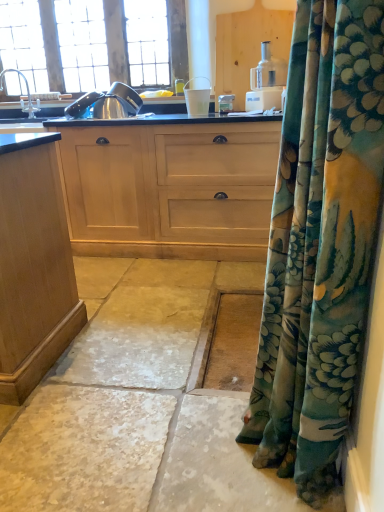
Question: Considering the relative positions of light wood cabinet at center and satin nickel faucet at upper left in the image provided, is light wood cabinet at center in front of satin nickel faucet at upper left?

Choices:
 (A) yes
 (B) no

Answer: (A)

Question: Does light wood cabinet at center appear on the left side of satin nickel faucet at upper left?

Choices:
 (A) no
 (B) yes

Answer: (A)

Question: Can you confirm if light wood cabinet at center is shorter than satin nickel faucet at upper left?

Choices:
 (A) yes
 (B) no

Answer: (B)

Question: From a real-world perspective, is light wood cabinet at center on satin nickel faucet at upper left?

Choices:
 (A) yes
 (B) no

Answer: (B)

Question: Considering the relative sizes of light wood cabinet at center and satin nickel faucet at upper left in the image provided, is light wood cabinet at center smaller than satin nickel faucet at upper left?

Choices:
 (A) yes
 (B) no

Answer: (B)

Question: Is light wood cabinet at center with satin nickel faucet at upper left?

Choices:
 (A) yes
 (B) no

Answer: (B)

Question: From the image's perspective, is white stone floor at lower center over white plastic cup at center?

Choices:
 (A) yes
 (B) no

Answer: (B)

Question: Considering the relative sizes of white stone floor at lower center and white plastic cup at center in the image provided, is white stone floor at lower center bigger than white plastic cup at center?

Choices:
 (A) yes
 (B) no

Answer: (A)

Question: Does white stone floor at lower center have a smaller size compared to white plastic cup at center?

Choices:
 (A) no
 (B) yes

Answer: (A)

Question: From the image's perspective, would you say white stone floor at lower center is shown under white plastic cup at center?

Choices:
 (A) yes
 (B) no

Answer: (A)

Question: Is white stone floor at lower center far away from white plastic cup at center?

Choices:
 (A) no
 (B) yes

Answer: (B)

Question: Is the position of white stone floor at lower center less distant than that of white plastic cup at center?

Choices:
 (A) no
 (B) yes

Answer: (B)

Question: Does satin nickel faucet at upper left come behind light wood cabinet at center?

Choices:
 (A) no
 (B) yes

Answer: (B)